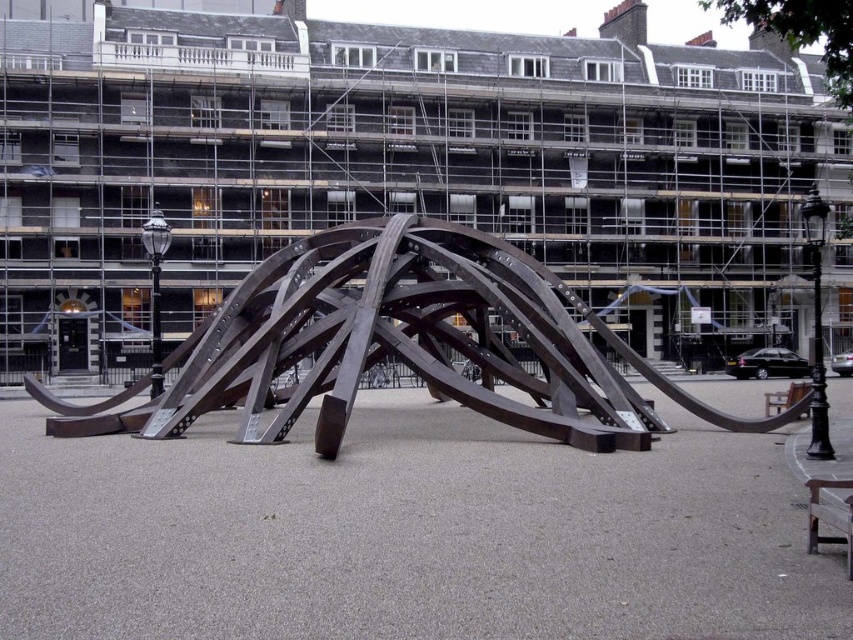
Question: Which of the following is the farthest from the observer?

Choices:
 (A) brown metallic sculpture at center
 (B) wooden park bench at lower right
 (C) wooden bench at lower right

Answer: (B)

Question: Is brown metallic sculpture at center positioned in front of wooden park bench at lower right?

Choices:
 (A) no
 (B) yes

Answer: (B)

Question: Does brown metallic sculpture at center have a larger size compared to wooden park bench at lower right?

Choices:
 (A) yes
 (B) no

Answer: (A)

Question: Which point is farther to the camera?

Choices:
 (A) wooden bench at lower right
 (B) brown metallic sculpture at center

Answer: (B)

Question: Among these objects, which one is farthest from the camera?

Choices:
 (A) brown metallic sculpture at center
 (B) wooden bench at lower right

Answer: (A)

Question: Is wooden bench at lower right positioned at the back of wooden park bench at lower right?

Choices:
 (A) no
 (B) yes

Answer: (A)